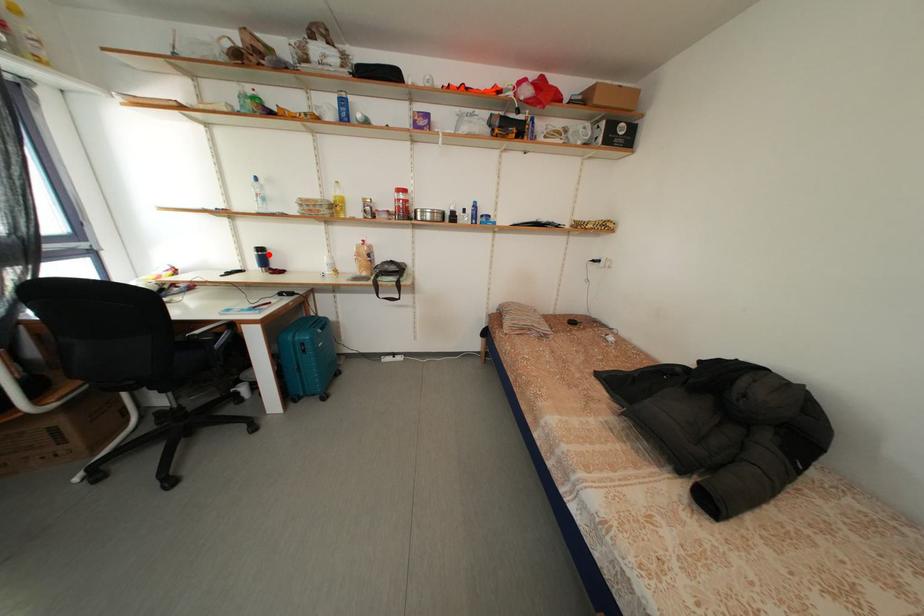
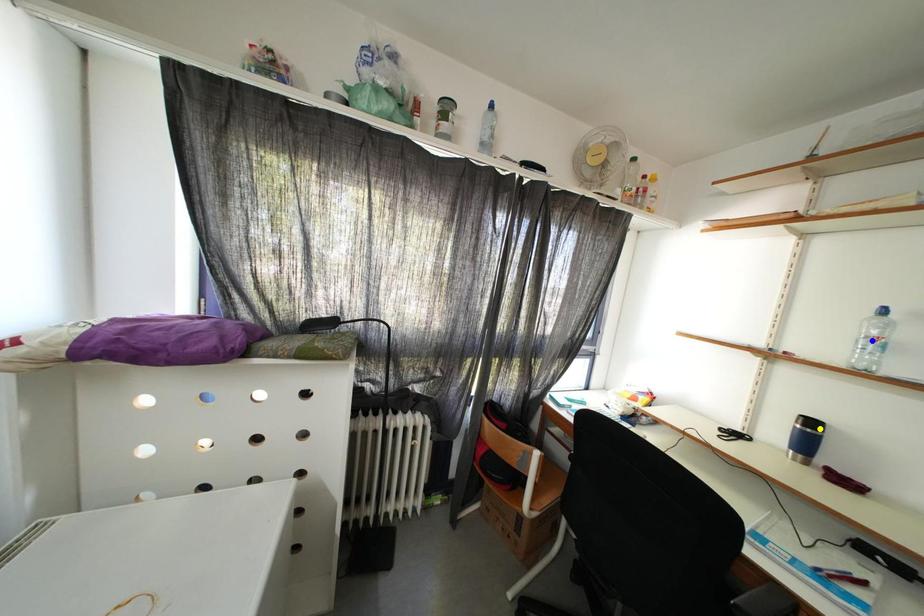
Question: I am providing you with two images of the same scene from different viewpoints. A red point is marked on the first image. You are given multiple points on the second image. In image 2, which mark is for the same physical point as the one in image 1?

Choices:
 (A) yellow point
 (B) green point
 (C) blue point

Answer: (A)